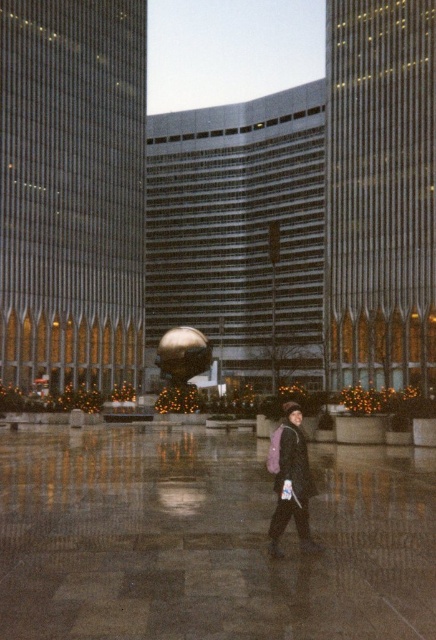
You are standing in the plaza and want to take a photo that includes both the point at coordinates (77, 621) and the point at (292, 465). Which point should you position closer to the front of the frame to ensure both are in focus?

You should position the point at coordinates (77, 621) closer to the front of the frame because it is closer to the camera than the point at (292, 465). This way, both points will be within the depth of field and in focus.

You are standing at point 0.5, 0.5 in the plaza and want to walk to the polished stone pavement at center. What direction should you move in?

The polished stone pavement at center is located at point (x=207, y=540). Since you are at (x=218, y=320), you should move northeast to reach it.

You are standing in the plaza and see the polished stone pavement at center and the dark gray woolen coat at center. Which object is closer to the ground?

The polished stone pavement at center is positioned under dark gray woolen coat at center, so the polished stone pavement at center is closer to the ground.